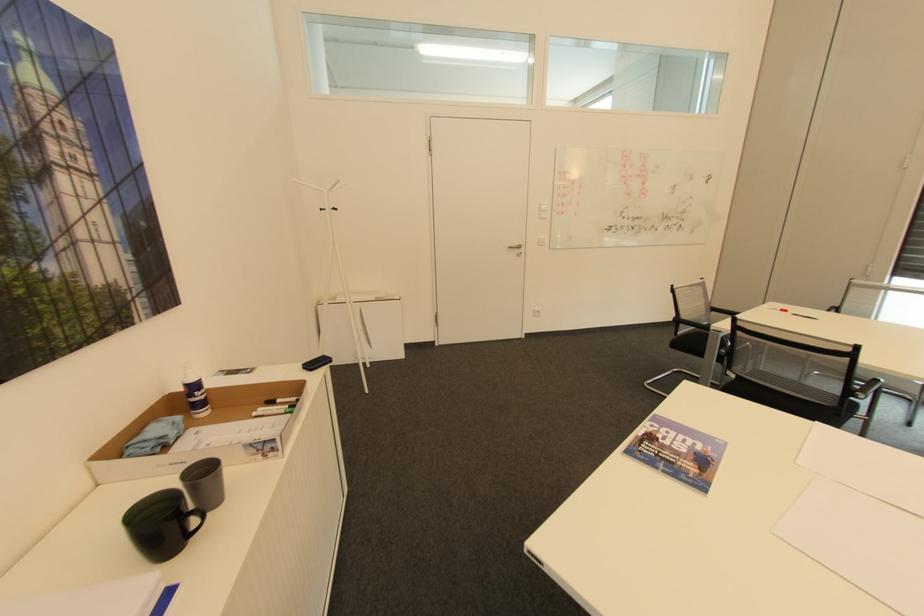
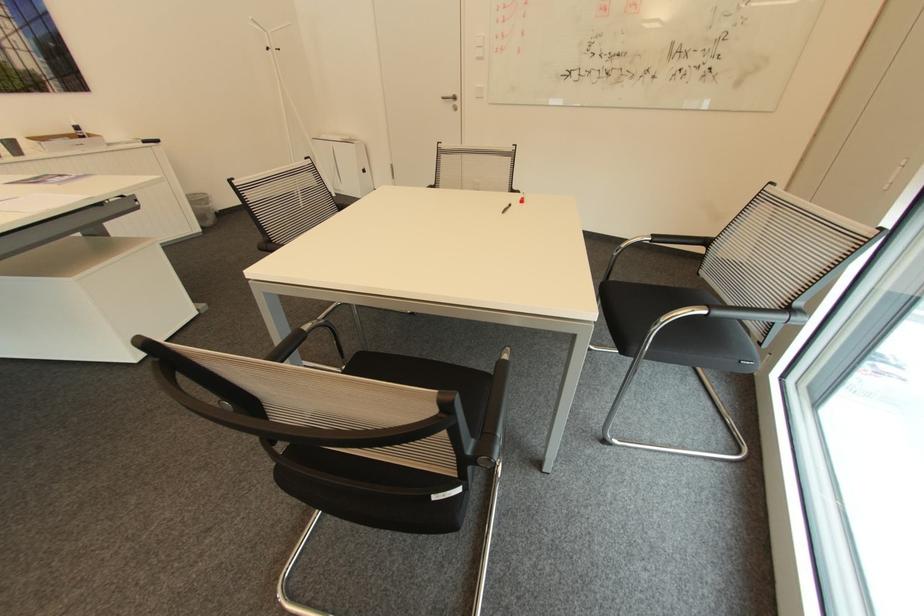
Find the pixel in the second image that matches point 520,244 in the first image.

(456, 95)